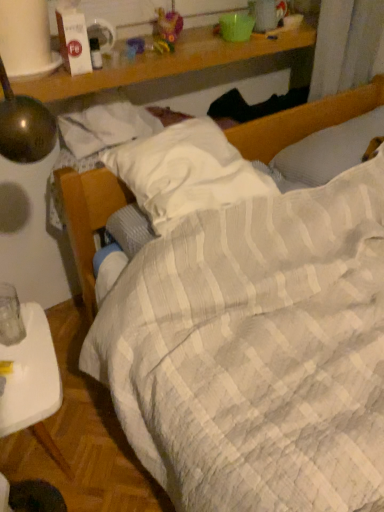
Question: Is the position of white plastic tray at lower left less distant than that of white textured pillow at upper right, which ranks as the 1th pillow in right-to-left order?

Choices:
 (A) no
 (B) yes

Answer: (B)

Question: Considering the relative sizes of white plastic tray at lower left and white textured pillow at upper right, which ranks as the 1th pillow in right-to-left order, in the image provided, is white plastic tray at lower left shorter than white textured pillow at upper right, which ranks as the 1th pillow in right-to-left order,?

Choices:
 (A) no
 (B) yes

Answer: (A)

Question: Is white plastic tray at lower left thinner than white textured pillow at upper right, marked as the 2th pillow in a left-to-right arrangement?

Choices:
 (A) no
 (B) yes

Answer: (B)

Question: From the image's perspective, is white plastic tray at lower left on white textured pillow at upper right, marked as the 2th pillow in a left-to-right arrangement?

Choices:
 (A) yes
 (B) no

Answer: (B)

Question: Is white plastic tray at lower left placed right next to white textured pillow at upper right, marked as the 2th pillow in a left-to-right arrangement?

Choices:
 (A) yes
 (B) no

Answer: (B)

Question: Looking at their shapes, would you say white textured pillow at upper right, which ranks as the 1th pillow in right-to-left order, is wider or thinner than white quilted pillow at center, which is the first pillow from left to right?

Choices:
 (A) wide
 (B) thin

Answer: (B)

Question: Would you say white textured pillow at upper right, marked as the 2th pillow in a left-to-right arrangement, is inside or outside white quilted pillow at center, the second pillow when ordered from right to left?

Choices:
 (A) inside
 (B) outside

Answer: (B)

Question: Would you say white textured pillow at upper right, which ranks as the 1th pillow in right-to-left order, is to the left or to the right of white quilted pillow at center, the second pillow when ordered from right to left, in the picture?

Choices:
 (A) left
 (B) right

Answer: (B)

Question: Is white textured pillow at upper right, which ranks as the 1th pillow in right-to-left order, bigger or smaller than white quilted pillow at center, the second pillow when ordered from right to left?

Choices:
 (A) small
 (B) big

Answer: (B)

Question: Visually, is white quilted pillow at center, the second pillow when ordered from right to left, positioned to the left or to the right of white plastic tray at lower left?

Choices:
 (A) left
 (B) right

Answer: (B)

Question: From the image's perspective, relative to white plastic tray at lower left, is white quilted pillow at center, the second pillow when ordered from right to left, above or below?

Choices:
 (A) below
 (B) above

Answer: (B)

Question: Would you say white quilted pillow at center, the second pillow when ordered from right to left, is inside or outside white plastic tray at lower left?

Choices:
 (A) inside
 (B) outside

Answer: (B)

Question: Is white quilted pillow at center, which is the first pillow from left to right, bigger or smaller than white plastic tray at lower left?

Choices:
 (A) small
 (B) big

Answer: (A)

Question: From the image's perspective, is white textured pillow at upper right, which ranks as the 1th pillow in right-to-left order, positioned above or below white plastic tray at lower left?

Choices:
 (A) below
 (B) above

Answer: (B)

Question: In terms of height, does white textured pillow at upper right, which ranks as the 1th pillow in right-to-left order, look taller or shorter compared to white plastic tray at lower left?

Choices:
 (A) short
 (B) tall

Answer: (A)